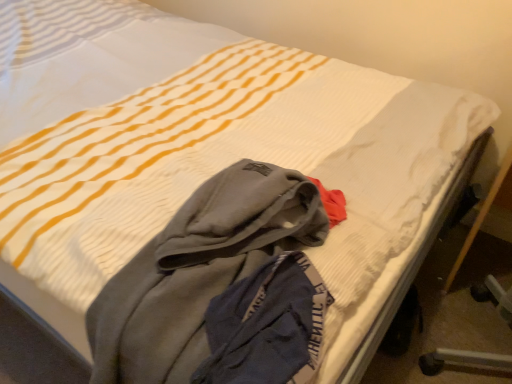
Question: Can we say gray fleece hoodie at center lies outside wooden bed frame at lower right?

Choices:
 (A) yes
 (B) no

Answer: (A)

Question: Is gray fleece hoodie at center aimed at wooden bed frame at lower right?

Choices:
 (A) yes
 (B) no

Answer: (B)

Question: Considering the relative sizes of gray fleece hoodie at center and wooden bed frame at lower right in the image provided, is gray fleece hoodie at center wider than wooden bed frame at lower right?

Choices:
 (A) no
 (B) yes

Answer: (A)

Question: Is gray fleece hoodie at center further to camera compared to wooden bed frame at lower right?

Choices:
 (A) no
 (B) yes

Answer: (A)

Question: Is gray fleece hoodie at center thinner than wooden bed frame at lower right?

Choices:
 (A) no
 (B) yes

Answer: (B)

Question: Is gray fleece hoodie at center shorter than wooden bed frame at lower right?

Choices:
 (A) yes
 (B) no

Answer: (A)

Question: Is wooden bed frame at lower right with gray fleece hoodie at center?

Choices:
 (A) no
 (B) yes

Answer: (A)

Question: Does wooden bed frame at lower right have a greater height compared to gray fleece hoodie at center?

Choices:
 (A) yes
 (B) no

Answer: (A)

Question: Is wooden bed frame at lower right at the left side of gray fleece hoodie at center?

Choices:
 (A) yes
 (B) no

Answer: (B)

Question: Is wooden bed frame at lower right bigger than gray fleece hoodie at center?

Choices:
 (A) yes
 (B) no

Answer: (A)

Question: From a real-world perspective, is wooden bed frame at lower right over gray fleece hoodie at center?

Choices:
 (A) yes
 (B) no

Answer: (B)

Question: From the image's perspective, is wooden bed frame at lower right on top of gray fleece hoodie at center?

Choices:
 (A) yes
 (B) no

Answer: (A)

Question: Considering the positions of gray fleece hoodie at center and wooden bed frame at lower right in the image, is gray fleece hoodie at center wider or thinner than wooden bed frame at lower right?

Choices:
 (A) thin
 (B) wide

Answer: (A)